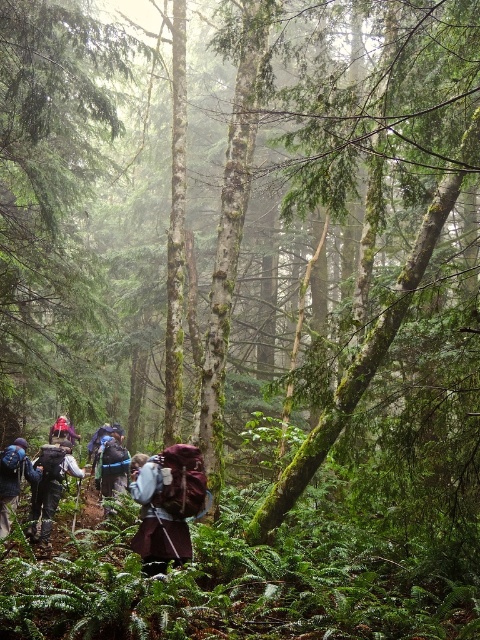
You are a hiker who just arrived at the forest and want to place your dark gray backpack at lower left exactly at the same position as the one in the image. What coordinates should you use?

The dark gray backpack at lower left should be placed at coordinates point [49,486].